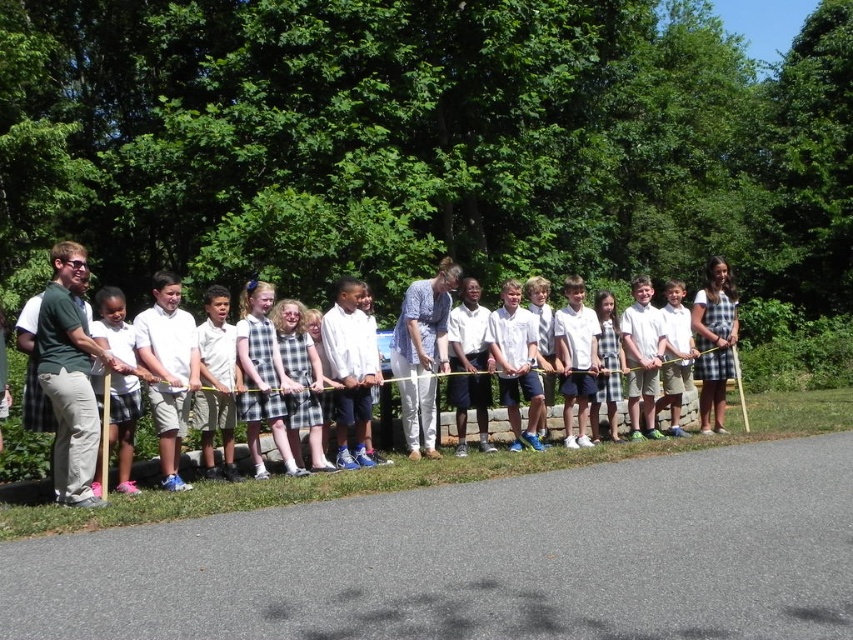
You are a photographer at the ribbon cutting ceremony. You want to capture a photo that includes both the pink fabric dress at left and the white cotton dress at center. Which dress should you focus on first to ensure both are in frame?

The pink fabric dress at left is positioned over the white cotton dress at center, so focusing on the pink fabric dress at left first will ensure both are visible in the photo.

You are standing at the center of the image and want to find the pink fabric dress at left. In which direction should you look to locate it?

The pink fabric dress at left is located at point (120, 378), which is to the left side of the image. You should look to the left to locate it.